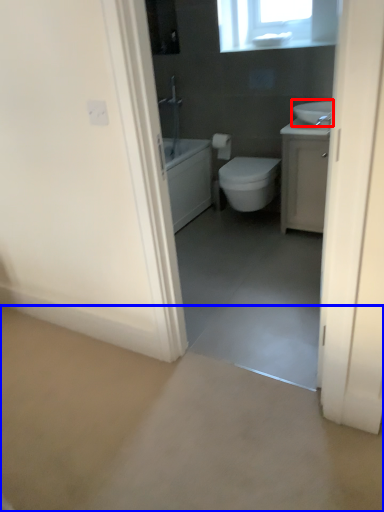
Question: Which point is closer to the camera, sink (highlighted by a red box) or concrete (highlighted by a blue box)?

Choices:
 (A) sink
 (B) concrete

Answer: (B)